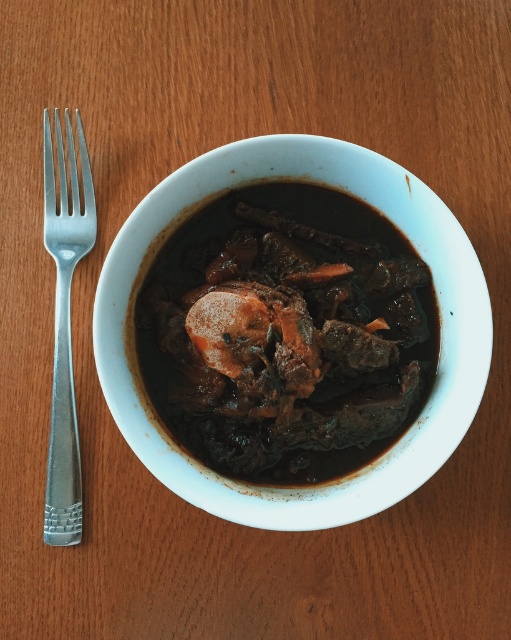
The height and width of the screenshot is (640, 511). I want to click on brown matte stew at center, so click(x=286, y=333).

Which is below, brown matte stew at center or silver metallic fork at left?

brown matte stew at center is lower down.

At what (x,y) coordinates should I click in order to perform the action: click on brown matte stew at center. Please return your answer as a coordinate pair (x, y). Image resolution: width=511 pixels, height=640 pixels. Looking at the image, I should click on (286, 333).